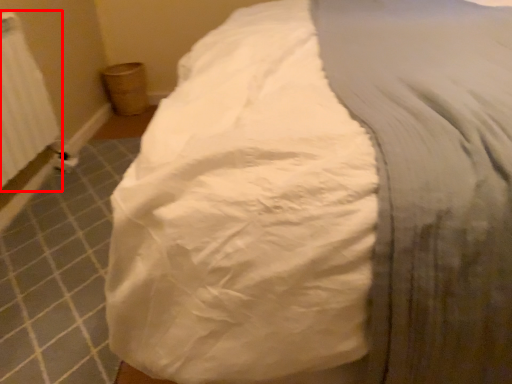
Question: Observing the image, what is the correct spatial positioning of radiator (annotated by the red box) in reference to sheet?

Choices:
 (A) left
 (B) right

Answer: (A)